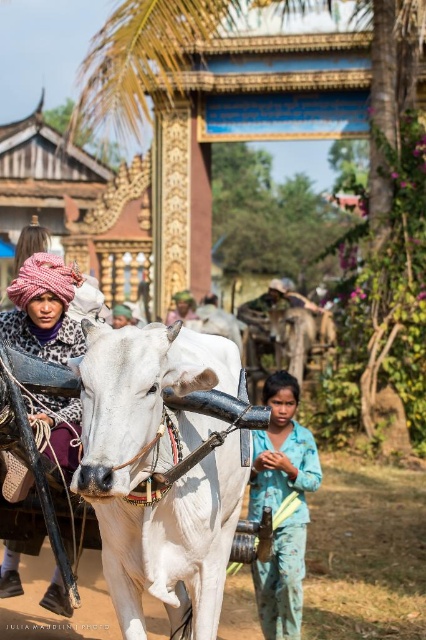
Question: Among these points, which one is farthest from the camera?

Choices:
 (A) (252, 516)
 (B) (66, 291)

Answer: (A)

Question: Can you confirm if blue cotton shirt at center is wider than knitted pink turban at left?

Choices:
 (A) yes
 (B) no

Answer: (B)

Question: Considering the relative positions of blue cotton shirt at center and knitted pink turban at left in the image provided, where is blue cotton shirt at center located with respect to knitted pink turban at left?

Choices:
 (A) left
 (B) right

Answer: (B)

Question: Can you confirm if blue cotton shirt at center is positioned below knitted pink turban at left?

Choices:
 (A) no
 (B) yes

Answer: (B)

Question: Which point is closer to the camera?

Choices:
 (A) knitted pink turban at left
 (B) blue cotton shirt at center

Answer: (A)